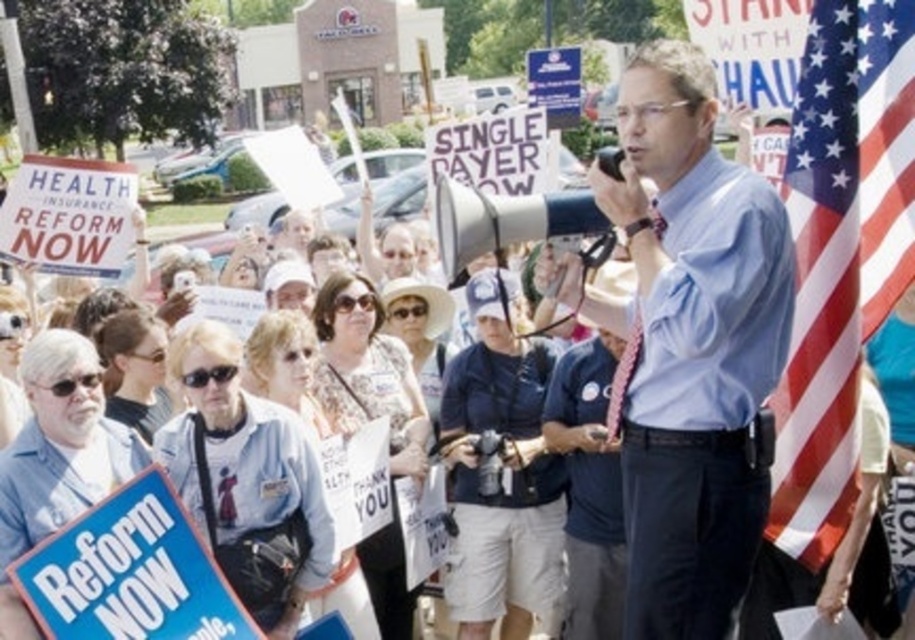
Question: Does american flag at right have a larger size compared to blue cardboard placard at lower left?

Choices:
 (A) yes
 (B) no

Answer: (A)

Question: Is american flag at right to the left of blue cardboard placard at lower left from the viewer's perspective?

Choices:
 (A) no
 (B) yes

Answer: (A)

Question: Among these objects, which one is nearest to the camera?

Choices:
 (A) light blue shirt at center
 (B) blue cardboard placard at lower left
 (C) american flag at right

Answer: (A)

Question: Estimate the real-world distances between objects in this image. Which object is closer to the blue cardboard placard at lower left?

Choices:
 (A) american flag at right
 (B) light blue shirt at center

Answer: (B)

Question: Among these objects, which one is nearest to the camera?

Choices:
 (A) blue cardboard placard at lower left
 (B) american flag at right
 (C) light blue shirt at center

Answer: (C)

Question: Is light blue shirt at center wider than american flag at right?

Choices:
 (A) no
 (B) yes

Answer: (B)